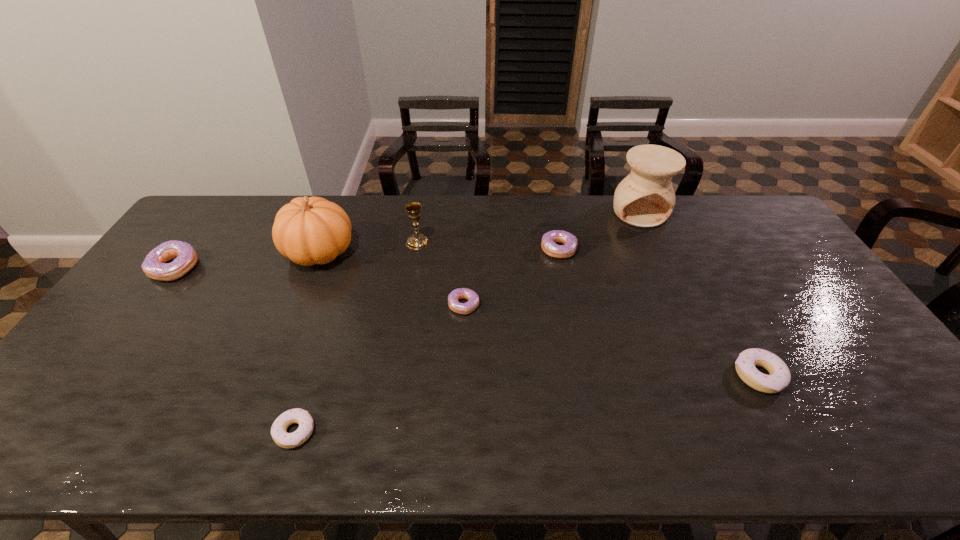
Locate an element on the screen. the farthest object is located at coordinates (645, 198).

Locate an element on the screen. pottery is located at coordinates (645, 198).

Where is `orange pumpkin`? orange pumpkin is located at coordinates (309, 231).

In order to click on chalice in this screenshot , I will do `click(417, 241)`.

The height and width of the screenshot is (540, 960). I want to click on the fourth object from left to right, so click(417, 241).

This screenshot has width=960, height=540. What are the coordinates of `the biggest purple doughnut` in the screenshot? It's located at (155, 266).

Where is `the leftmost purple doughnut`? the leftmost purple doughnut is located at coordinates (155, 266).

Locate an element on the screen. the rightmost purple doughnut is located at coordinates (549, 239).

This screenshot has height=540, width=960. In order to click on the third object from right to left in this screenshot , I will do `click(549, 239)`.

The image size is (960, 540). I want to click on the rightmost doughnut, so click(x=779, y=378).